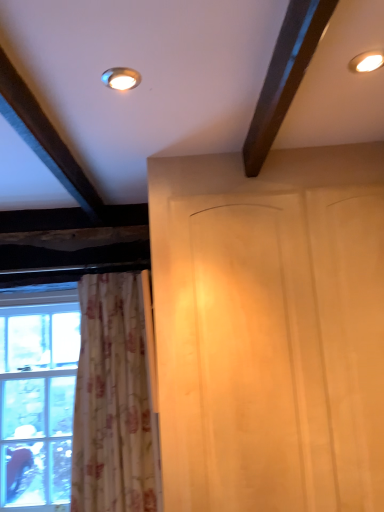
Question: Is clear glass window at left bigger than matte gold light fixture at upper center, which appears as the second lighting when viewed from the right?

Choices:
 (A) no
 (B) yes

Answer: (B)

Question: Is the position of clear glass window at left less distant than that of matte gold light fixture at upper center, the 1th lighting positioned from the bottom?

Choices:
 (A) yes
 (B) no

Answer: (B)

Question: Can you confirm if clear glass window at left is smaller than matte gold light fixture at upper center, which appears as the second lighting when viewed from the right?

Choices:
 (A) no
 (B) yes

Answer: (A)

Question: Can you confirm if clear glass window at left is taller than matte gold light fixture at upper center, the 2th lighting when ordered from top to bottom?

Choices:
 (A) no
 (B) yes

Answer: (B)

Question: Is matte gold light fixture at upper center, the 1th lighting positioned from the bottom, a part of clear glass window at left?

Choices:
 (A) no
 (B) yes

Answer: (A)

Question: From a real-world perspective, is clear glass window at left beneath matte gold light fixture at upper center, the 1th lighting positioned from the bottom?

Choices:
 (A) no
 (B) yes

Answer: (B)

Question: Is white floral fabric curtain at left to the right of matte white light fixture at upper right, positioned as the first lighting in top-to-bottom order, from the viewer's perspective?

Choices:
 (A) yes
 (B) no

Answer: (B)

Question: Does white floral fabric curtain at left appear on the left side of matte white light fixture at upper right, positioned as the first lighting in top-to-bottom order?

Choices:
 (A) no
 (B) yes

Answer: (B)

Question: Is white floral fabric curtain at left shorter than matte white light fixture at upper right, the 2th lighting from the left?

Choices:
 (A) yes
 (B) no

Answer: (B)

Question: From a real-world perspective, is white floral fabric curtain at left physically below matte white light fixture at upper right, which is counted as the second lighting, starting from the bottom?

Choices:
 (A) yes
 (B) no

Answer: (A)

Question: From the image's perspective, would you say white floral fabric curtain at left is positioned over matte white light fixture at upper right, which is counted as the second lighting, starting from the bottom?

Choices:
 (A) yes
 (B) no

Answer: (B)

Question: Is white floral fabric curtain at left positioned behind matte white light fixture at upper right, the 2th lighting from the left?

Choices:
 (A) yes
 (B) no

Answer: (A)

Question: Does white wood screen door at center come behind white floral fabric curtain at left?

Choices:
 (A) no
 (B) yes

Answer: (A)